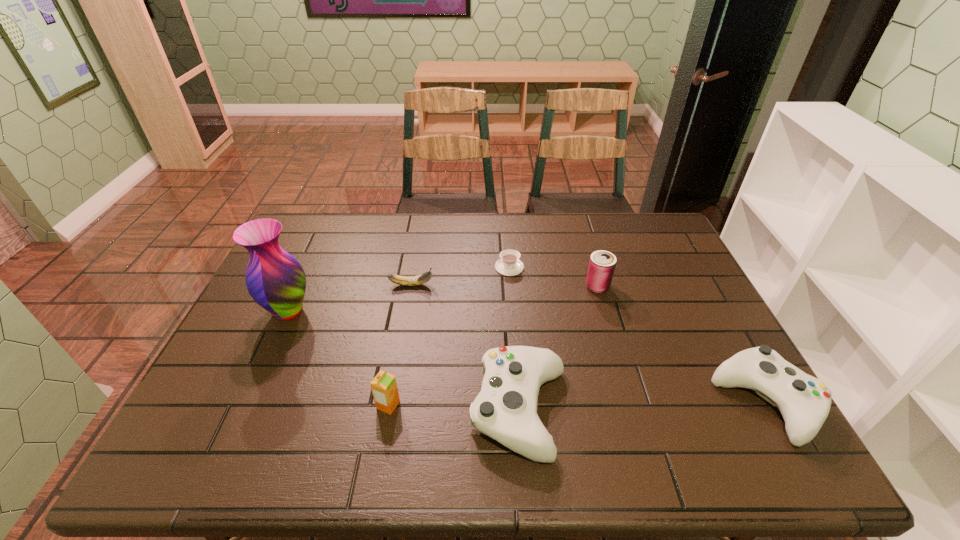
This screenshot has width=960, height=540. What are the coordinates of `the taller control` in the screenshot? It's located at (505, 409).

Where is `the right control`? the right control is located at coordinates (804, 401).

You are a GUI agent. You are given a task and a screenshot of the screen. Output one action in this format:
    pyautogui.click(x=<x>, y=<y>)
    Task: Click on the rightmost object
    The height and width of the screenshot is (540, 960).
    Given the screenshot: What is the action you would take?
    pyautogui.click(x=804, y=401)

At what (x,y) coordinates should I click in order to perform the action: click on teacup. Please return your answer as a coordinate pair (x, y). This screenshot has width=960, height=540. Looking at the image, I should click on (509, 265).

What are the coordinates of `the shortest object` in the screenshot? It's located at (509, 265).

This screenshot has width=960, height=540. Find the location of `can`. can is located at coordinates (601, 267).

Find the location of a particular element. Image resolution: width=960 pixels, height=540 pixels. banana is located at coordinates (425, 277).

You are a GUI agent. You are given a task and a screenshot of the screen. Output one action in this format:
    pyautogui.click(x=<x>, y=<y>)
    Task: Click on the orange juice
    This screenshot has width=960, height=540.
    Given the screenshot: What is the action you would take?
    pyautogui.click(x=384, y=388)

Where is `the leftmost object`? the leftmost object is located at coordinates (274, 278).

The width and height of the screenshot is (960, 540). I want to click on vase, so click(x=274, y=278).